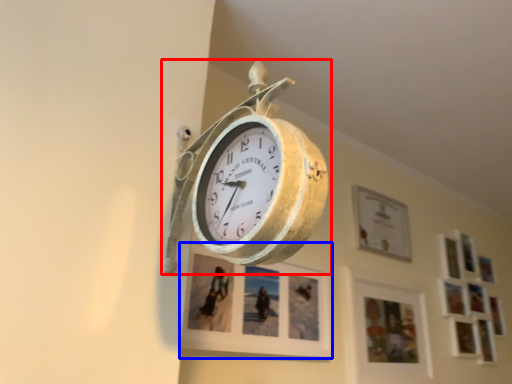
Question: Which point is further to the camera, wall clock (highlighted by a red box) or picture frame (highlighted by a blue box)?

Choices:
 (A) wall clock
 (B) picture frame

Answer: (B)